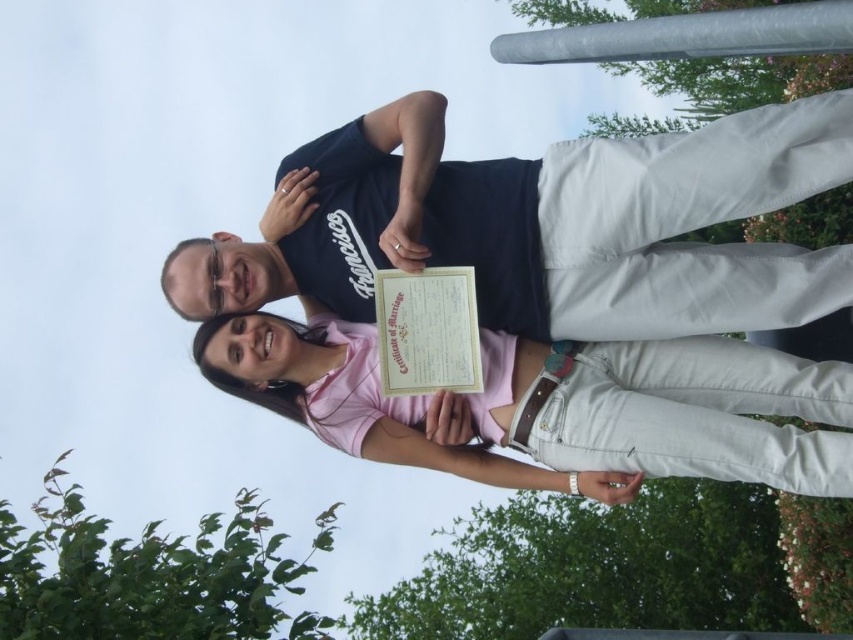
Does dark blue t-shirt at center appear under pink cotton shirt at center?

Actually, dark blue t-shirt at center is above pink cotton shirt at center.

Is dark blue t-shirt at center to the right of pink cotton shirt at center from the viewer's perspective?

In fact, dark blue t-shirt at center is to the left of pink cotton shirt at center.

Which is in front, point (364, 188) or point (556, 349)?

Point (556, 349) is in front.

Identify the location of dark blue t-shirt at center. The width and height of the screenshot is (853, 640). (550, 227).

Can you confirm if dark blue t-shirt at center is positioned above yellow paper certificate at center?

Correct, dark blue t-shirt at center is located above yellow paper certificate at center.

Can you confirm if dark blue t-shirt at center is positioned to the right of yellow paper certificate at center?

Incorrect, dark blue t-shirt at center is not on the right side of yellow paper certificate at center.

At what (x,y) coordinates should I click in order to perform the action: click on dark blue t-shirt at center. Please return your answer as a coordinate pair (x, y). This screenshot has height=640, width=853. Looking at the image, I should click on (550, 227).

Locate an element on the screen. Image resolution: width=853 pixels, height=640 pixels. dark blue t-shirt at center is located at coordinates (550, 227).

Can you confirm if pink cotton shirt at center is positioned below yellow paper certificate at center?

Yes, pink cotton shirt at center is below yellow paper certificate at center.

Between point (370, 330) and point (453, 378), which one is positioned in front?

Positioned in front is point (453, 378).

Locate an element on the screen. This screenshot has width=853, height=640. pink cotton shirt at center is located at coordinates (554, 406).